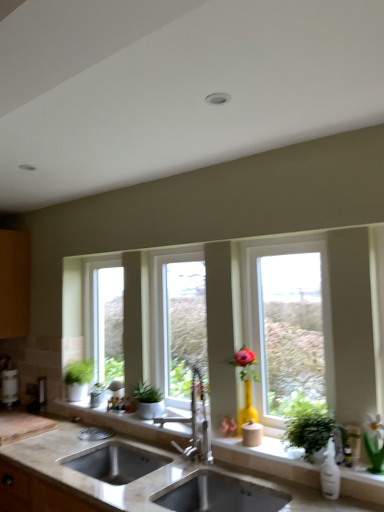
Question: Considering the positions of satin nickel faucet at center and clear glass window at center, the third window in the left-to-right sequence, in the image, is satin nickel faucet at center taller or shorter than clear glass window at center, the third window in the left-to-right sequence,?

Choices:
 (A) tall
 (B) short

Answer: (B)

Question: Relative to clear glass window at center, placed as the first window when sorted from front to back, is satin nickel faucet at center in front or behind?

Choices:
 (A) behind
 (B) front

Answer: (B)

Question: Which is nearer to the matte wood cabinet at left?

Choices:
 (A) matte gray sink at center
 (B) green matte houseplant at lower left, the second houseplant viewed from the left
 (C) satin nickel faucet at center
 (D) clear glass window at center, placed as the first window when sorted from front to back
 (E) green matte plant at center, positioned as the 3th houseplant in left-to-right order

Answer: (B)

Question: Which is farther from the clear glass window at center, which is the second window from left to right?

Choices:
 (A) matte wood cabinet at left
 (B) green leafy plant at right, which is counted as the first houseplant, starting from the right
 (C) clear glass window at center, the first window positioned from the right
 (D) green matte houseplant at lower left, the second houseplant viewed from the left
 (E) satin nickel faucet at center

Answer: (A)